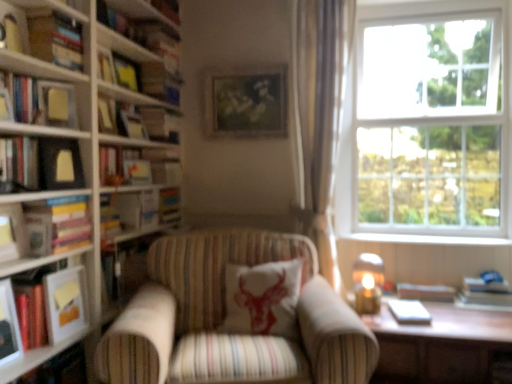
I want to click on vacant area located to the right-hand side of white matte paperback book at lower right, the first paperback book when ordered from bottom to top, so click(x=444, y=318).